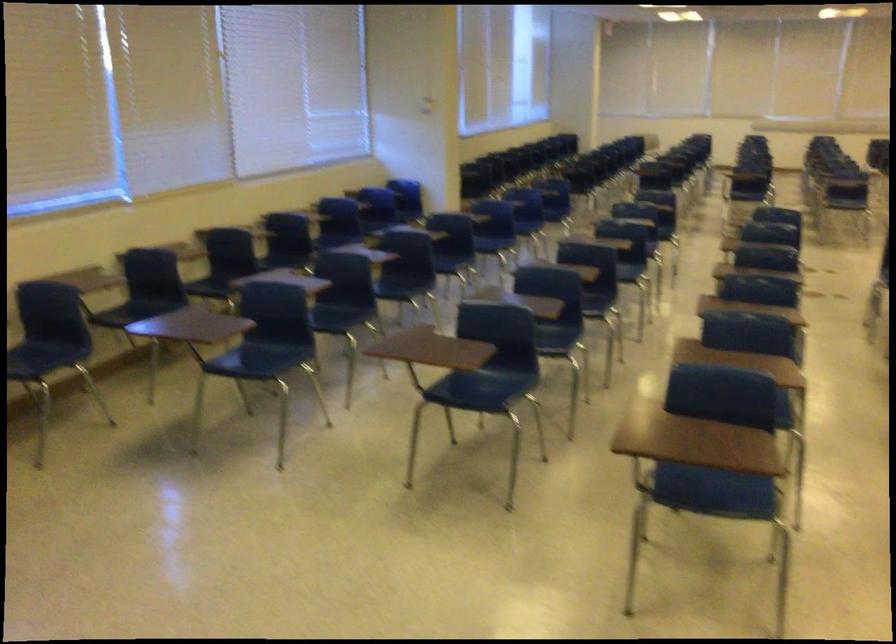
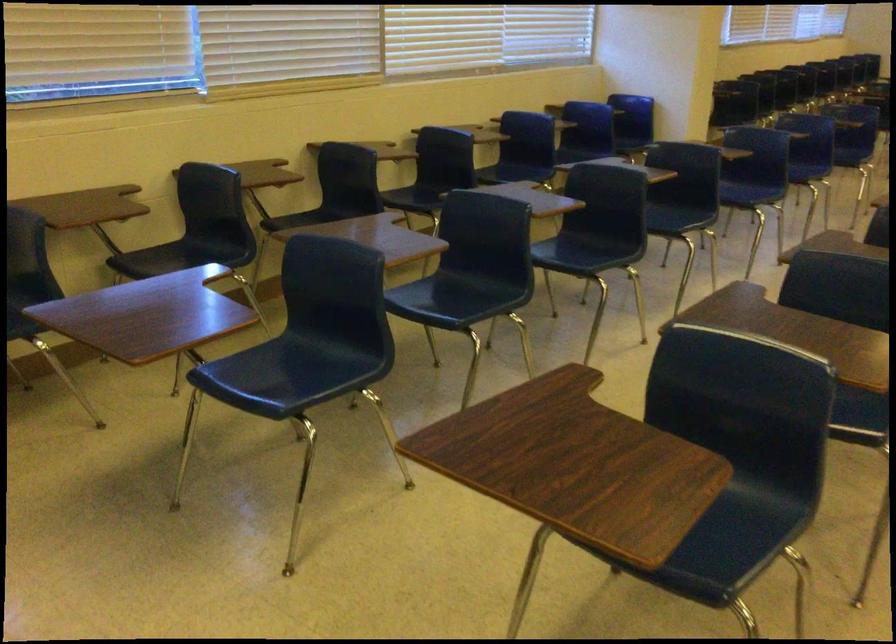
Question: Which direction would the cameraman need to move to produce the second image? Reply with the corresponding letter.

Choices:
 (A) Left
 (B) Right
 (C) Forward
 (D) Backward

Answer: (C)